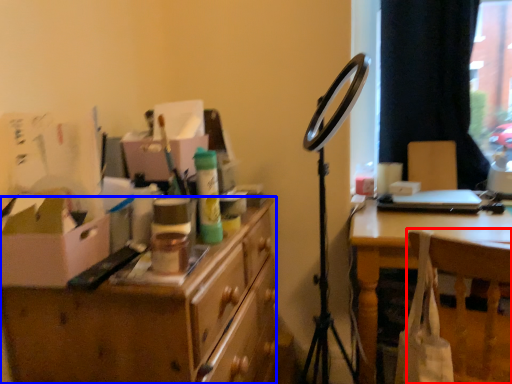
Question: Among these objects, which one is farthest to the camera, chair (highlighted by a red box) or desk (highlighted by a blue box)?

Choices:
 (A) chair
 (B) desk

Answer: (A)